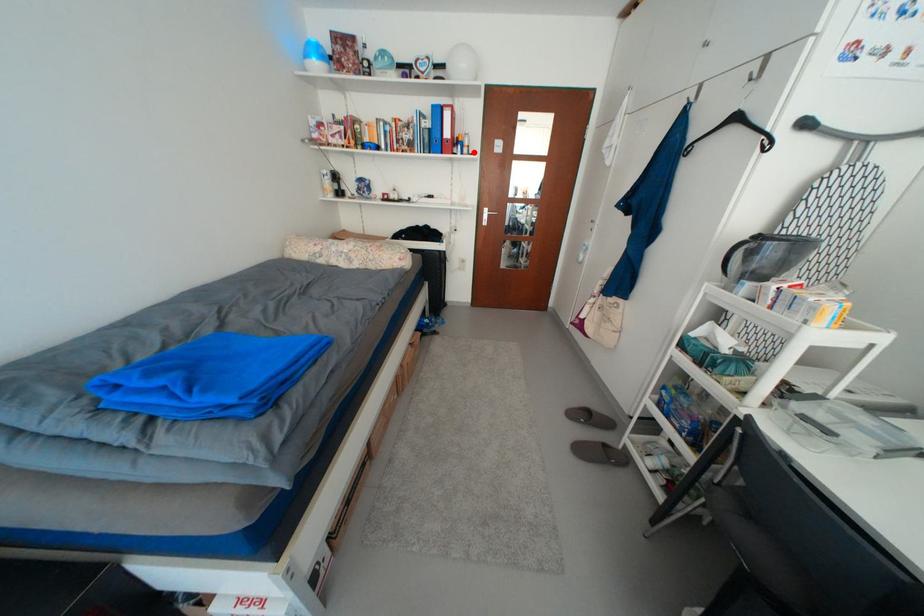
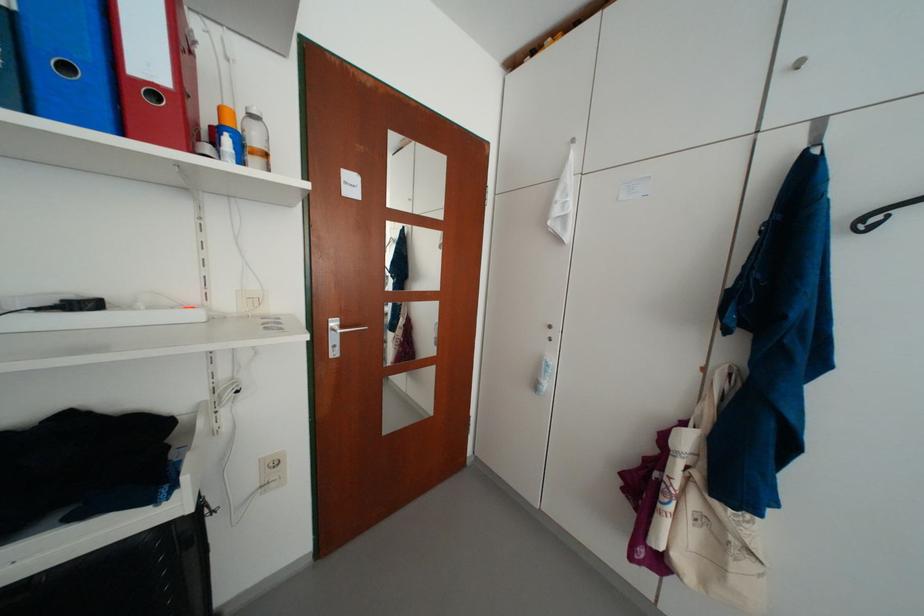
Find the pixel in the second image that matches the highlighted location in the first image.

(263, 163)